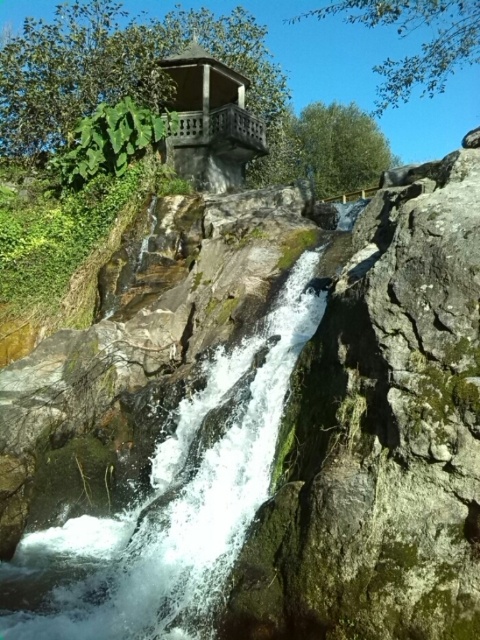
You are a hiker who wants to reach the wooden gazebo at upper center from the white frothy water at center. Given that your average walking pace is 3 feet per second, how many seconds will it take you to walk directly to the gazebo?

The distance between the white frothy water at center and the wooden gazebo at upper center is 45.49 feet. At a pace of 3 feet per second, it would take approximately 15.16 seconds to walk directly to the gazebo.